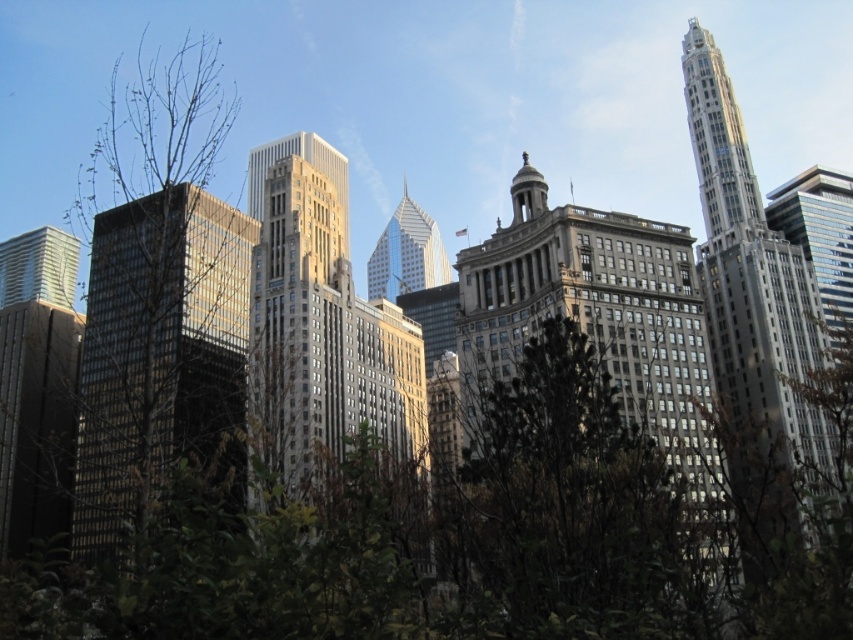
Question: Which object is the closest to the silver glass skyscraper at right?

Choices:
 (A) green leafy bush at center
 (B) brown stone building at center
 (C) matte glass skyscraper at left

Answer: (B)

Question: Is silver glass skyscraper at right thinner than silver glass skyscraper at center?

Choices:
 (A) no
 (B) yes

Answer: (A)

Question: Which point is farther from the camera taking this photo?

Choices:
 (A) (270, 268)
 (B) (393, 234)

Answer: (B)

Question: Can you confirm if bare branches at left is positioned to the right of silver glass skyscraper at right?

Choices:
 (A) yes
 (B) no

Answer: (B)

Question: Based on their relative distances, which object is nearer to the gray glass skyscraper at center?

Choices:
 (A) matte glass skyscraper at left
 (B) brown stone building at center
 (C) green leafy bush at center

Answer: (C)

Question: Does bare branches at left come in front of gray glass skyscraper at center?

Choices:
 (A) no
 (B) yes

Answer: (B)